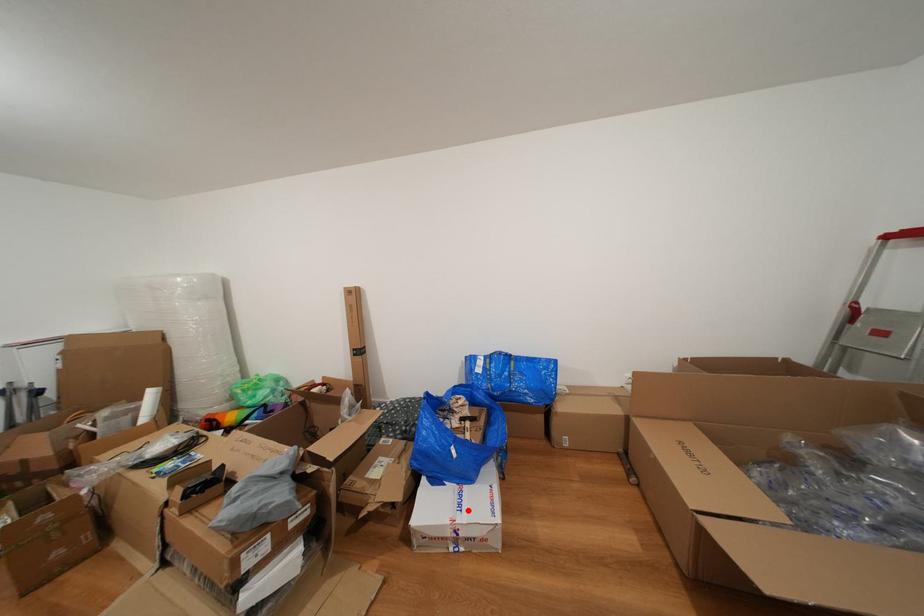
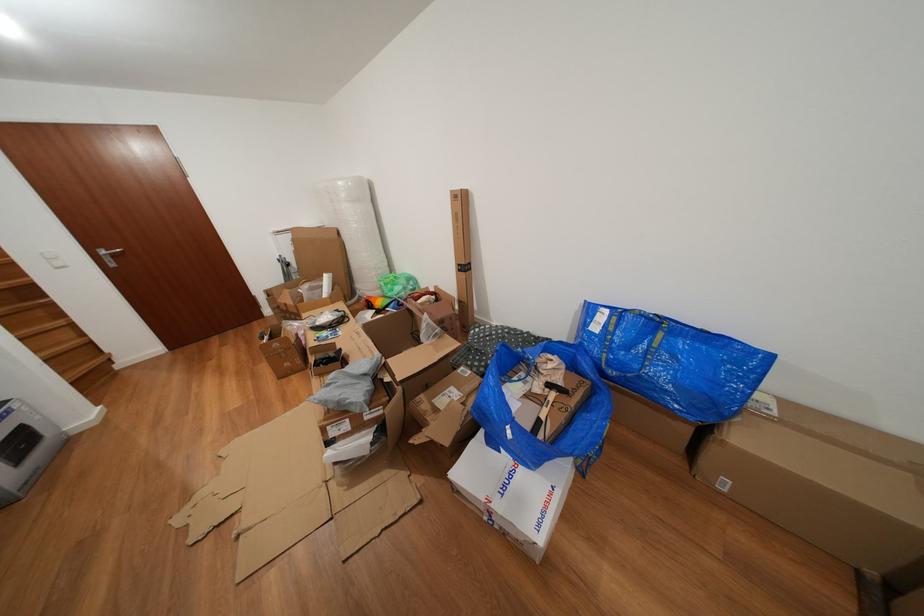
Question: I am providing you with two images of the same scene from different viewpoints. In image1, a red point is highlighted. Considering the same 3D point in image2, which of the following is correct?

Choices:
 (A) It is closer
 (B) It is farther

Answer: (A)